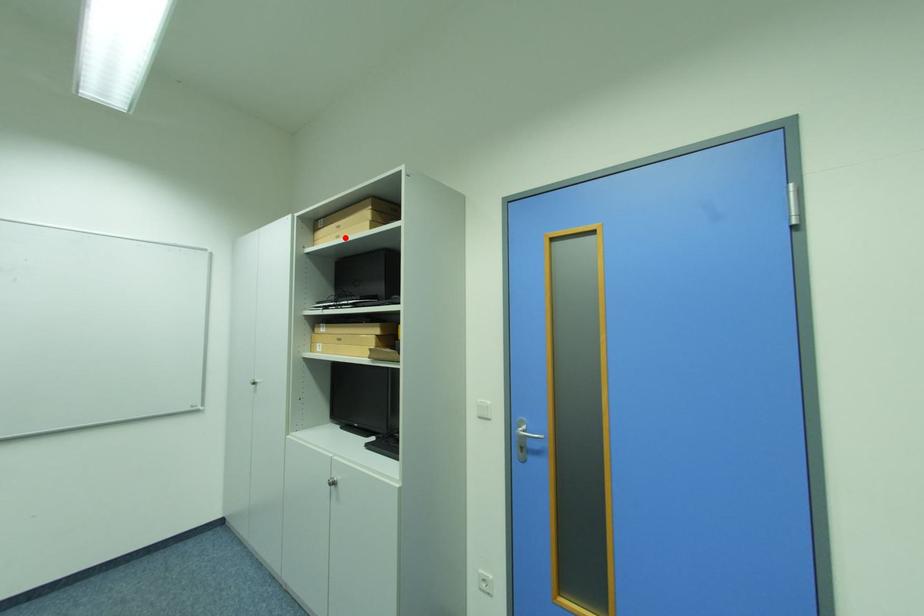
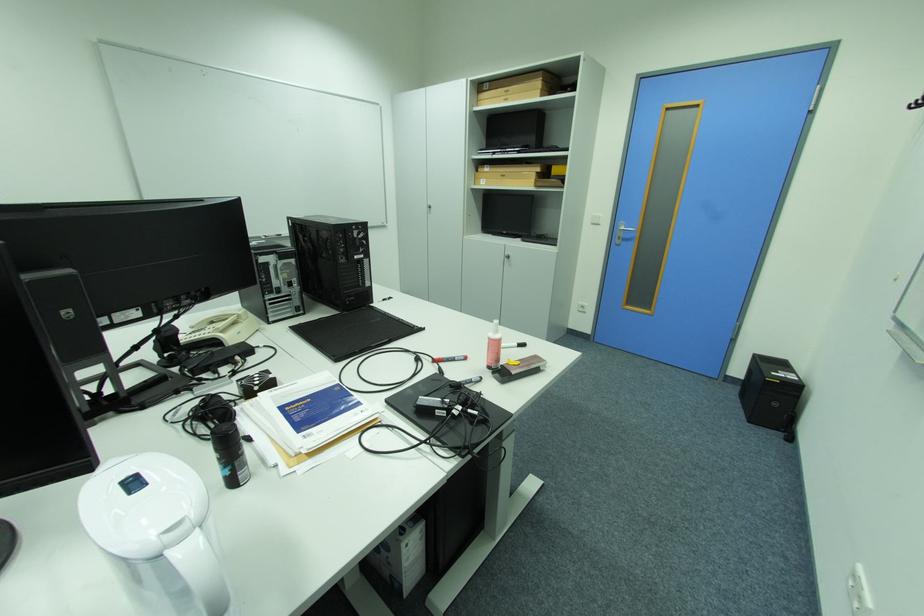
Question: I am providing you with two images of the same scene from different viewpoints. Given a red point in image1, look at the same physical point in image2. Is it:

Choices:
 (A) Closer to the viewpoint
 (B) Farther from the viewpoint

Answer: (A)